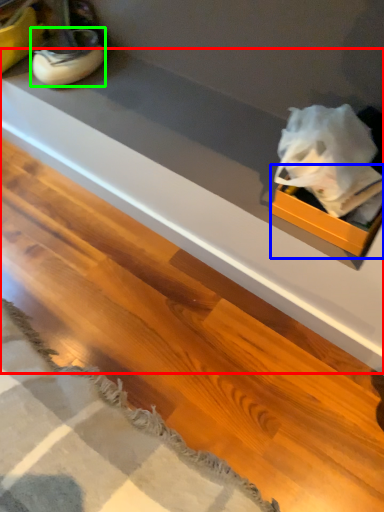
Question: Estimate the real-world distances between objects in this image. Which object is closer to counter top (highlighted by a red box), box (highlighted by a blue box) or footwear (highlighted by a green box)?

Choices:
 (A) box
 (B) footwear

Answer: (A)